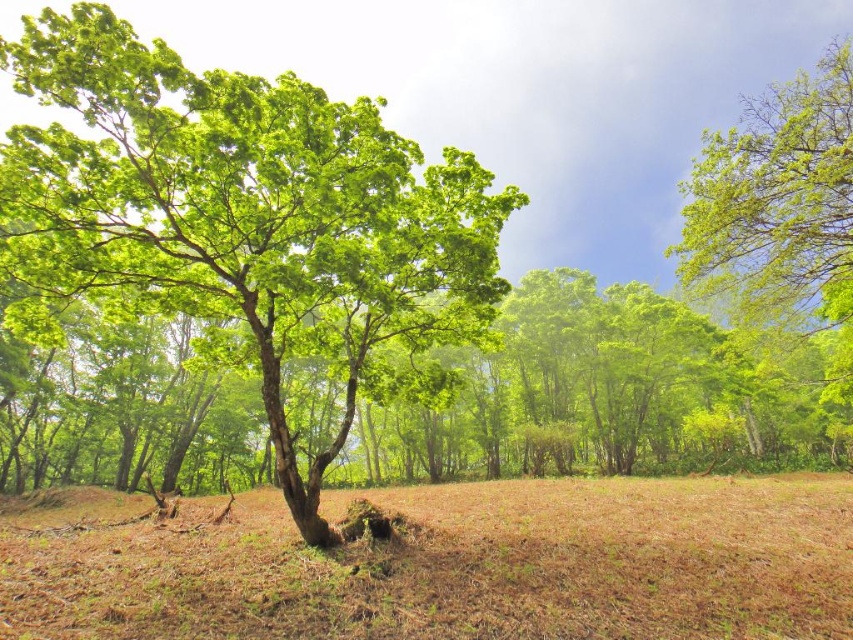
Who is taller, brown dry grass at center or green leafy tree at upper right?

With more height is green leafy tree at upper right.

Locate an element on the screen. brown dry grass at center is located at coordinates (445, 564).

Based on the photo, who is more forward, (3, 525) or (846, 125)?

Point (3, 525) is in front.

At what (x,y) coordinates should I click in order to perform the action: click on brown dry grass at center. Please return your answer as a coordinate pair (x, y). The height and width of the screenshot is (640, 853). Looking at the image, I should click on (445, 564).

Does green leafy tree at center appear on the right side of brown dry grass at center?

In fact, green leafy tree at center is to the left of brown dry grass at center.

Which is in front, point (318, 332) or point (78, 497)?

Point (318, 332) is in front.

The width and height of the screenshot is (853, 640). I want to click on green leafy tree at center, so click(242, 211).

Who is higher up, green leafy tree at center or green leafy tree at upper right?

Positioned higher is green leafy tree at upper right.

Does point (316, 292) come in front of point (833, 188)?

Yes, point (316, 292) is closer to viewer.

Who is more distant from viewer, (358, 144) or (759, 305)?

The point (759, 305) is behind.

The height and width of the screenshot is (640, 853). Find the location of `green leafy tree at center`. green leafy tree at center is located at coordinates (242, 211).